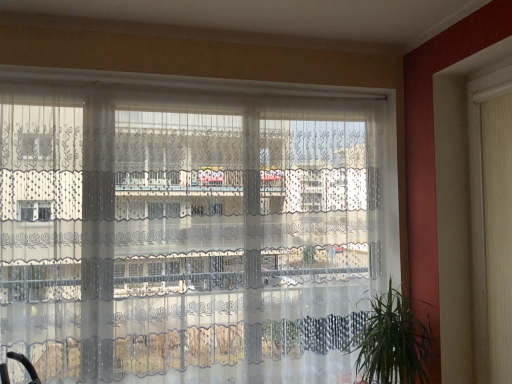
Question: Is white fabric shutter at right not inside transparent lace curtains at center?

Choices:
 (A) no
 (B) yes

Answer: (B)

Question: Is there a large distance between white fabric shutter at right and transparent lace curtains at center?

Choices:
 (A) no
 (B) yes

Answer: (B)

Question: Does white fabric shutter at right have a smaller size compared to transparent lace curtains at center?

Choices:
 (A) yes
 (B) no

Answer: (A)

Question: Does white fabric shutter at right come in front of transparent lace curtains at center?

Choices:
 (A) yes
 (B) no

Answer: (A)

Question: From a real-world perspective, is white fabric shutter at right physically below transparent lace curtains at center?

Choices:
 (A) no
 (B) yes

Answer: (A)

Question: Is the position of white fabric shutter at right more distant than that of transparent lace curtains at center?

Choices:
 (A) no
 (B) yes

Answer: (A)

Question: Does white fabric shutter at right appear on the left side of green leafy plant at lower right?

Choices:
 (A) no
 (B) yes

Answer: (A)

Question: From the image's perspective, is white fabric shutter at right below green leafy plant at lower right?

Choices:
 (A) no
 (B) yes

Answer: (A)

Question: From the image's perspective, is white fabric shutter at right located above green leafy plant at lower right?

Choices:
 (A) yes
 (B) no

Answer: (A)

Question: Is white fabric shutter at right taller than green leafy plant at lower right?

Choices:
 (A) yes
 (B) no

Answer: (A)

Question: Is white fabric shutter at right behind green leafy plant at lower right?

Choices:
 (A) yes
 (B) no

Answer: (B)

Question: From a real-world perspective, is white fabric shutter at right below green leafy plant at lower right?

Choices:
 (A) yes
 (B) no

Answer: (B)

Question: From a real-world perspective, is green leafy plant at lower right on top of white fabric shutter at right?

Choices:
 (A) yes
 (B) no

Answer: (B)